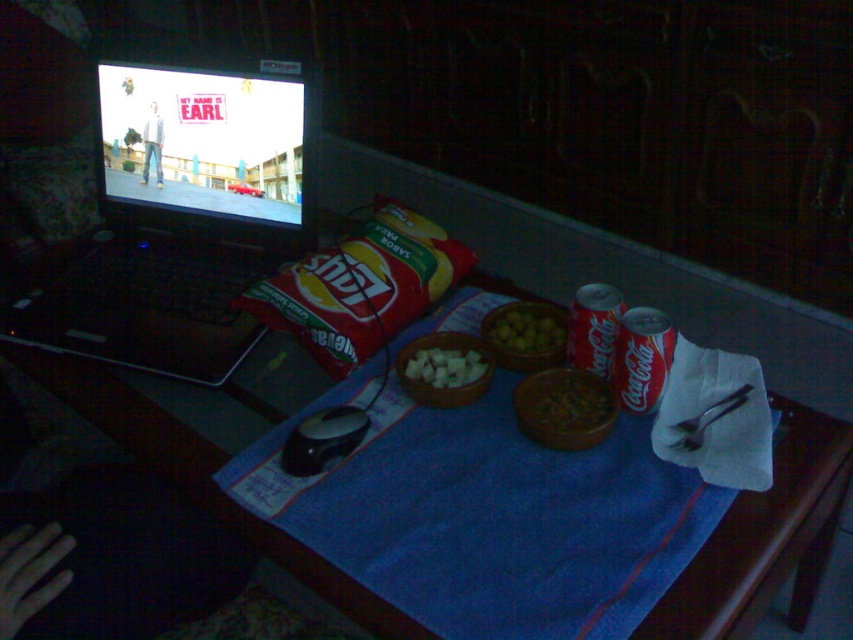
You are a guest in this room and want to place a small vase between the blue fabric tablecloth at center and the brown matte bowl at center. Based on their positions, where should you place the vase?

The blue fabric tablecloth at center is positioned on the left side of the brown matte bowl at center, so you should place the vase to the right of the blue fabric tablecloth at center and to the left of the brown matte bowl at center.

You are organizing items on a table and need to place both the blue fabric tablecloth at center and the brown matte bowl at center. Which item should you place first to ensure the other fits properly?

You should place the blue fabric tablecloth at center first because it is larger in size than the brown matte bowl at center, so placing the larger item first ensures there is enough space left for the smaller one.

You are a guest in this room and want to grab a snack. The host mentioned there are chips and a drink available. You see the white paper towel at right and the brown matte bowl at center. Which object is bigger?

The white paper towel at right is larger in size compared to the brown matte bowl at center.